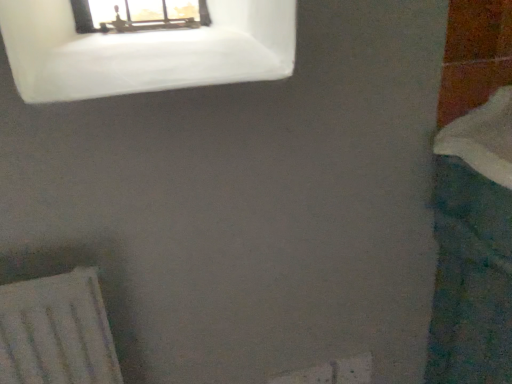
What do you see at coordinates (473, 248) in the screenshot?
I see `teal fabric bath at right` at bounding box center [473, 248].

I want to click on teal fabric bath at right, so click(x=473, y=248).

The width and height of the screenshot is (512, 384). What do you see at coordinates (144, 51) in the screenshot?
I see `white frosted glass window at upper left` at bounding box center [144, 51].

In order to face white frosted glass window at upper left, should I rotate leftwards or rightwards?

To align with it, rotate left about 13.349°.

This screenshot has width=512, height=384. In order to click on white frosted glass window at upper left in this screenshot , I will do `click(144, 51)`.

Where is `teal fabric bath at right`? The image size is (512, 384). teal fabric bath at right is located at coordinates (473, 248).

In the image, is teal fabric bath at right on the left side or the right side of white frosted glass window at upper left?

teal fabric bath at right is to the right of white frosted glass window at upper left.

Does teal fabric bath at right come in front of white frosted glass window at upper left?

Yes, it is in front of white frosted glass window at upper left.

Considering the points (504, 260) and (24, 37), which point is behind, point (504, 260) or point (24, 37)?

The point (504, 260) is farther.

From the image's perspective, would you say teal fabric bath at right is shown under white frosted glass window at upper left?

Yes, from the image's perspective, teal fabric bath at right is below white frosted glass window at upper left.

From a real-world perspective, which object rests below the other?

In real-world perspective, teal fabric bath at right is lower.

Is teal fabric bath at right wider or thinner than white frosted glass window at upper left?

In the image, teal fabric bath at right appears to be wider than white frosted glass window at upper left.

From their relative heights in the image, would you say teal fabric bath at right is taller or shorter than white frosted glass window at upper left?

Considering their sizes, teal fabric bath at right has more height than white frosted glass window at upper left.

Consider the image. Considering the sizes of objects teal fabric bath at right and white frosted glass window at upper left in the image provided, who is smaller, teal fabric bath at right or white frosted glass window at upper left?

Smaller between the two is white frosted glass window at upper left.

Would you say white frosted glass window at upper left is part of teal fabric bath at right's contents?

Definitely not — white frosted glass window at upper left is not inside teal fabric bath at right.

Is teal fabric bath at right placed right next to white frosted glass window at upper left?

No, teal fabric bath at right is not in contact with white frosted glass window at upper left.

Is teal fabric bath at right facing towards white frosted glass window at upper left?

No, teal fabric bath at right is not aimed at white frosted glass window at upper left.

Can you tell me how much teal fabric bath at right and white frosted glass window at upper left differ in facing direction?

86.8 degrees.

Locate an element on the screen. Image resolution: width=512 pixels, height=384 pixels. bath on the right side of white frosted glass window at upper left is located at coordinates (473, 248).

Is white frosted glass window at upper left to the left of teal fabric bath at right from the viewer's perspective?

Yes, white frosted glass window at upper left is to the left of teal fabric bath at right.

Which is in front, white frosted glass window at upper left or teal fabric bath at right?

teal fabric bath at right is more forward.

Is point (276, 69) positioned after point (484, 370)?

That is False.

From the image's perspective, is white frosted glass window at upper left positioned above or below teal fabric bath at right?

Clearly, from the image's perspective, white frosted glass window at upper left is above teal fabric bath at right.

From a real-world perspective, between white frosted glass window at upper left and teal fabric bath at right, who is vertically higher?

white frosted glass window at upper left, from a real-world perspective.

Consider the image. Is white frosted glass window at upper left thinner than teal fabric bath at right?

Yes, white frosted glass window at upper left is thinner than teal fabric bath at right.

From their relative heights in the image, would you say white frosted glass window at upper left is taller or shorter than teal fabric bath at right?

In the image, white frosted glass window at upper left appears to be shorter than teal fabric bath at right.

Between white frosted glass window at upper left and teal fabric bath at right, which one has smaller size?

Smaller between the two is white frosted glass window at upper left.

Is teal fabric bath at right inside white frosted glass window at upper left?

No.

Is there a large distance between white frosted glass window at upper left and teal fabric bath at right?

Actually, white frosted glass window at upper left and teal fabric bath at right are a little close together.

Is white frosted glass window at upper left facing away from teal fabric bath at right?

That's not correct — white frosted glass window at upper left is not looking away from teal fabric bath at right.

What's the angular difference between white frosted glass window at upper left and teal fabric bath at right's facing directions?

86.8 degrees separate the facing orientations of white frosted glass window at upper left and teal fabric bath at right.

The width and height of the screenshot is (512, 384). In the image, there is a white frosted glass window at upper left. What are the coordinates of `bath below it (from a real-world perspective)` in the screenshot? It's located at point(473,248).

This screenshot has width=512, height=384. Find the location of `window lying behind the teal fabric bath at right`. window lying behind the teal fabric bath at right is located at coordinates (144, 51).

Locate an element on the screen. window above the teal fabric bath at right (from the image's perspective) is located at coordinates (144, 51).